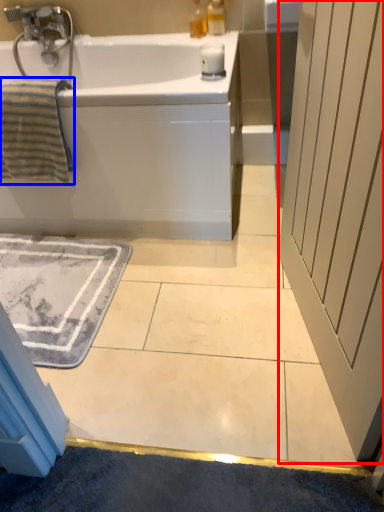
Question: Which point is further to the camera, screen door (highlighted by a red box) or bath towel (highlighted by a blue box)?

Choices:
 (A) screen door
 (B) bath towel

Answer: (B)